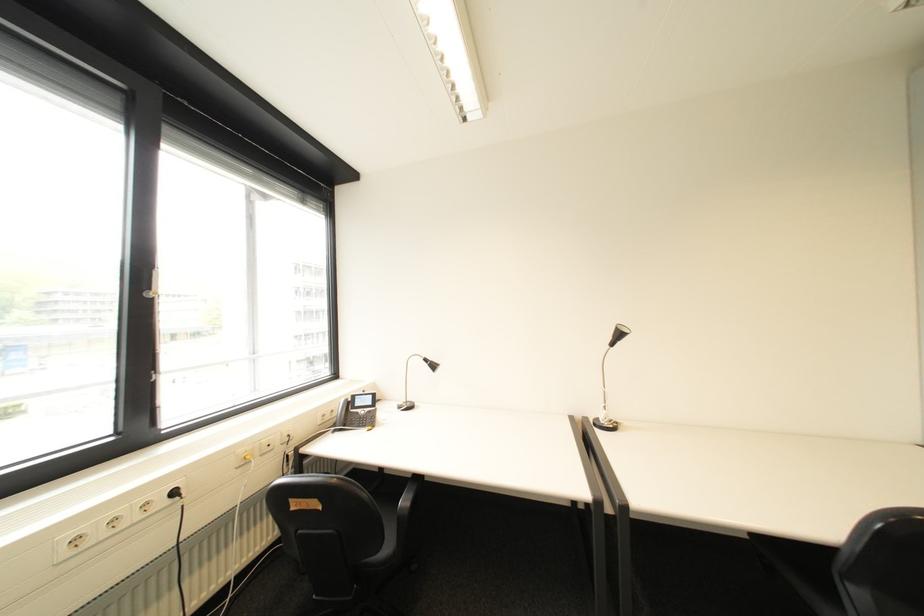
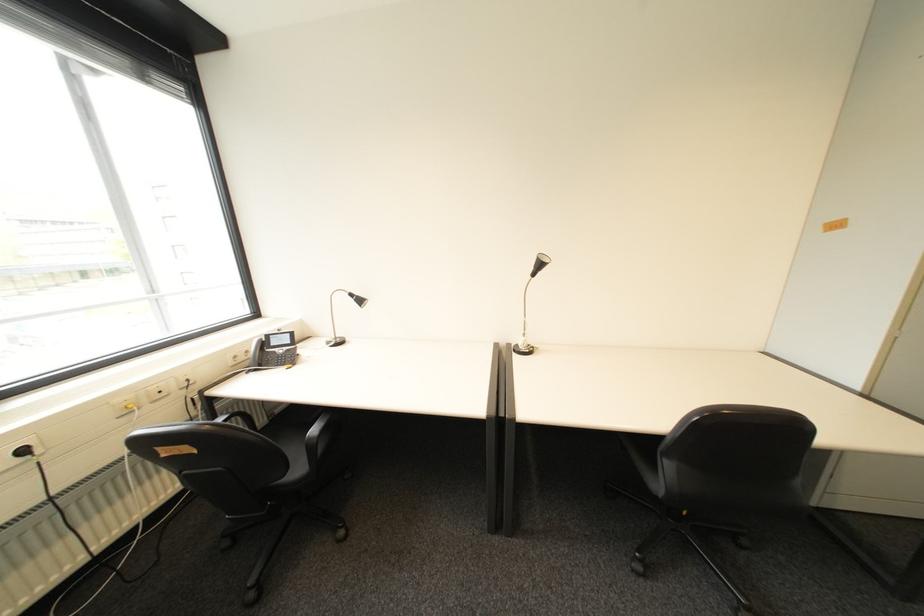
Locate, in the second image, the point that corresponds to pixel 436 365 in the first image.

(362, 301)